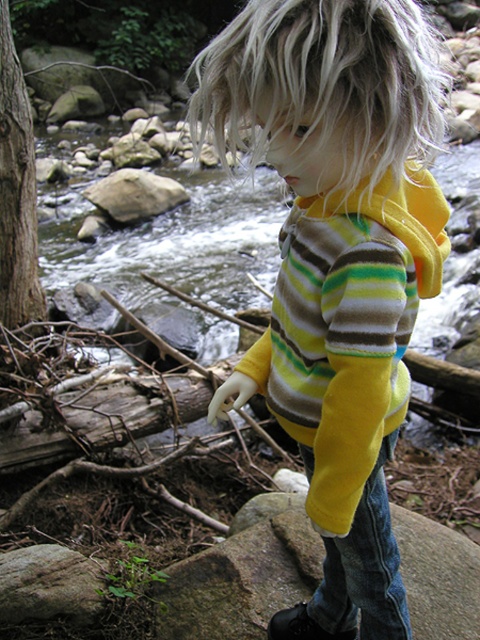
Is point (297, 125) in front of point (142, 173)?

Yes, it is in front of point (142, 173).

Which is more to the right, blondehair at center or smooth gray rock at center?

blondehair at center

Does point (422, 128) come in front of point (168, 189)?

Yes.

Locate an element on the screen. blondehair at center is located at coordinates (324, 83).

Between yellow fleece hoodie at center and smooth gray rock at center, which one is positioned lower?

yellow fleece hoodie at center

Is point (389, 625) in front of point (178, 189)?

Yes, it is in front of point (178, 189).

Who is more distant from viewer, [375,554] or [130,186]?

Positioned behind is point [130,186].

Where is `yellow fleece hoodie at center`? yellow fleece hoodie at center is located at coordinates (336, 266).

Which is more to the left, jeans at lower center or smooth gray rock at center?

Positioned to the left is smooth gray rock at center.

Does jeans at lower center have a lesser height compared to smooth gray rock at center?

Indeed, jeans at lower center has a lesser height compared to smooth gray rock at center.

The image size is (480, 640). Identify the location of jeans at lower center. (364, 568).